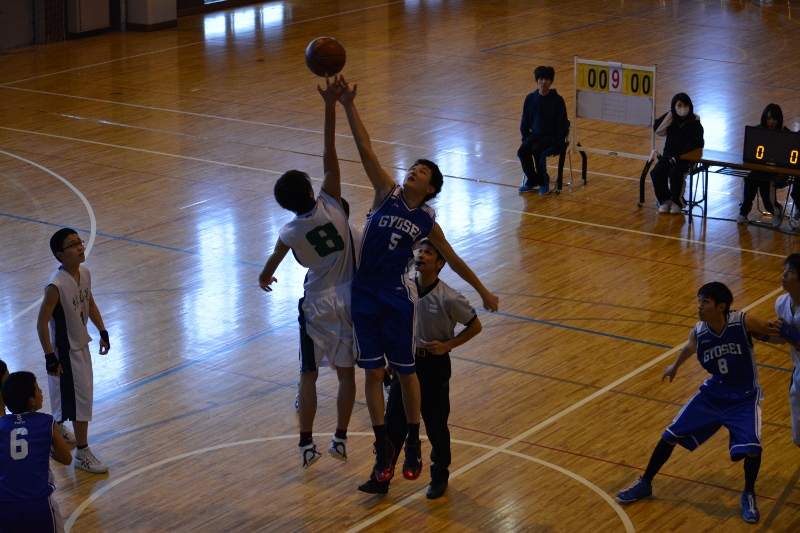
You are a GUI agent. You are given a task and a screenshot of the screen. Output one action in this format:
    pyautogui.click(x=<x>, y=<y>)
    Task: Click on the door
    The height and width of the screenshot is (533, 800).
    Given the screenshot: What is the action you would take?
    pyautogui.click(x=210, y=0)